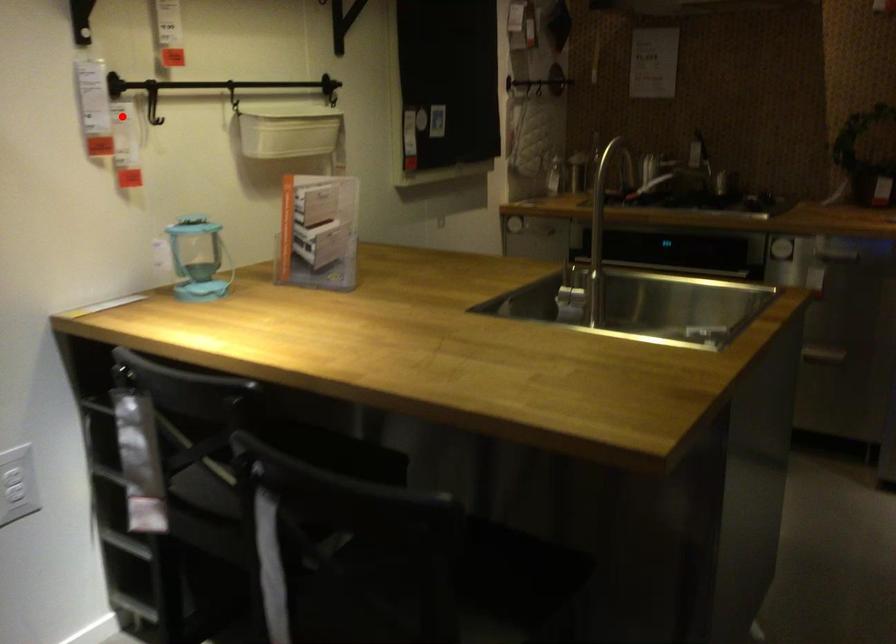
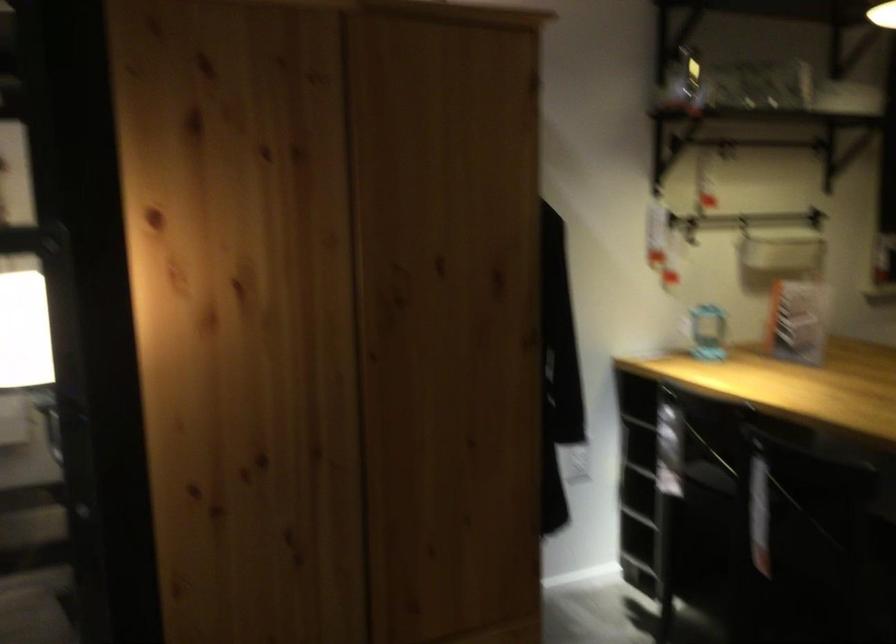
Locate, in the second image, the point that corresponds to the highlighted location in the first image.

(690, 228)